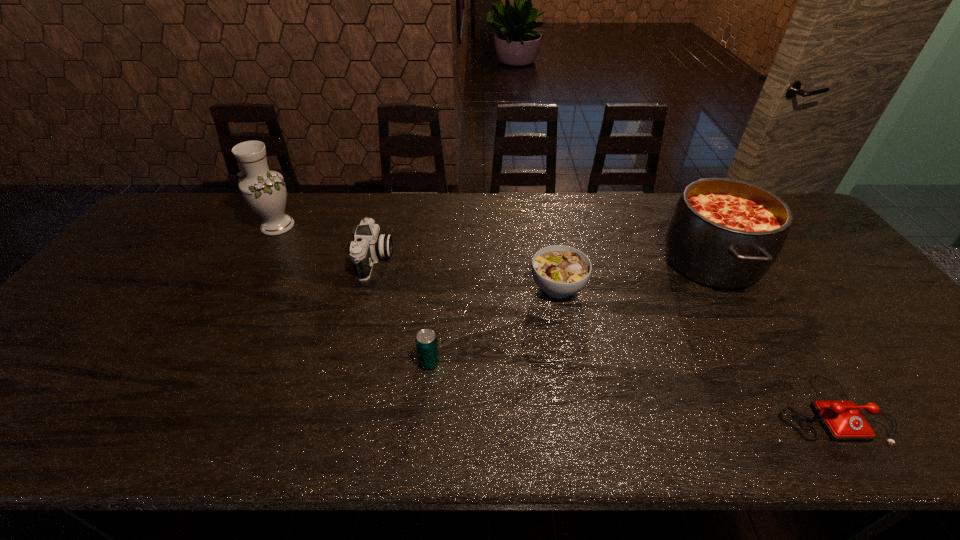
This screenshot has height=540, width=960. In order to click on vacant space that's between the nearest object and the second object from left to right in this screenshot , I will do `click(602, 334)`.

At what (x,y) coordinates should I click in order to perform the action: click on vacant space that's between the beer can and the fifth shortest object. Please return your answer as a coordinate pair (x, y). Looking at the image, I should click on (570, 311).

Locate an element on the screen. Image resolution: width=960 pixels, height=540 pixels. object that is the third closest to the leftmost object is located at coordinates (560, 271).

The height and width of the screenshot is (540, 960). I want to click on object that is the third closest to the nearest object, so click(x=426, y=341).

Find the location of `free space that satisfies the following two spatial constraints: 1. on the back side of the second tallest object; 2. on the left side of the fourth object from left to right`. free space that satisfies the following two spatial constraints: 1. on the back side of the second tallest object; 2. on the left side of the fourth object from left to right is located at coordinates (553, 260).

In order to click on vacant area in the image that satisfies the following two spatial constraints: 1. on the front side of the beer can; 2. on the left side of the second object from left to right in this screenshot , I will do pyautogui.click(x=348, y=362).